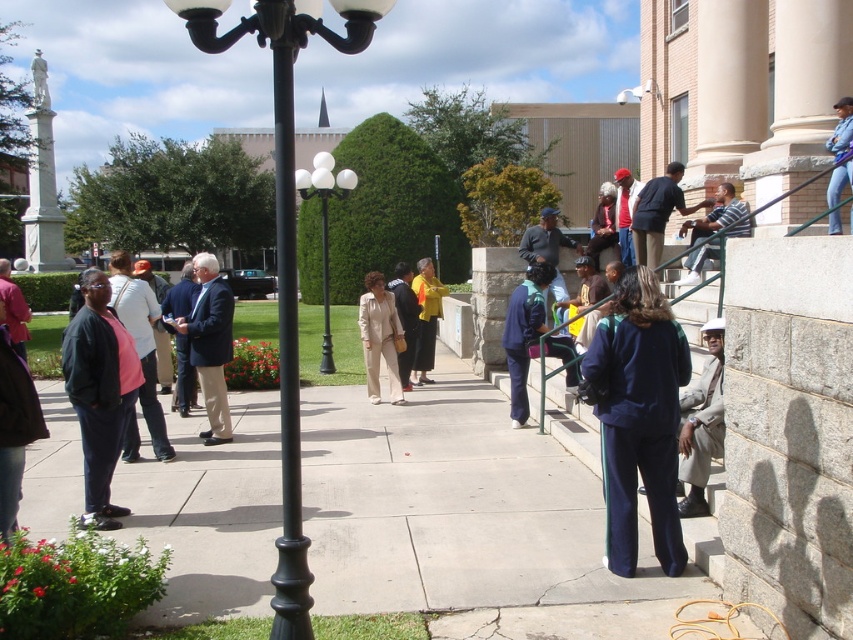
Is navy blue track suit at lower right further to the viewer compared to white glossy lamp post at center?

No, it is not.

This screenshot has width=853, height=640. What are the coordinates of `navy blue track suit at lower right` in the screenshot? It's located at (637, 417).

Is light brown leather jacket at lower right thinner than light pink fabric jacket at left?

No, light brown leather jacket at lower right is not thinner than light pink fabric jacket at left.

Does light brown leather jacket at lower right have a greater height compared to light pink fabric jacket at left?

Correct, light brown leather jacket at lower right is much taller as light pink fabric jacket at left.

Does point (712, 340) come farther from viewer compared to point (170, 458)?

That is False.

You are a GUI agent. You are given a task and a screenshot of the screen. Output one action in this format:
    pyautogui.click(x=<x>, y=<y>)
    Task: Click on the light brown leather jacket at lower right
    The width and height of the screenshot is (853, 640).
    Given the screenshot: What is the action you would take?
    pyautogui.click(x=701, y=424)

Who is more forward, (283, 488) or (207, 340)?

Point (283, 488)

Does black metal lamp post at left have a smaller size compared to dark blue suit at center?

Correct, black metal lamp post at left occupies less space than dark blue suit at center.

Does point (209, 0) lie behind point (202, 369)?

No, it is not.

Where is `black metal lamp post at left`? This screenshot has height=640, width=853. black metal lamp post at left is located at coordinates (285, 243).